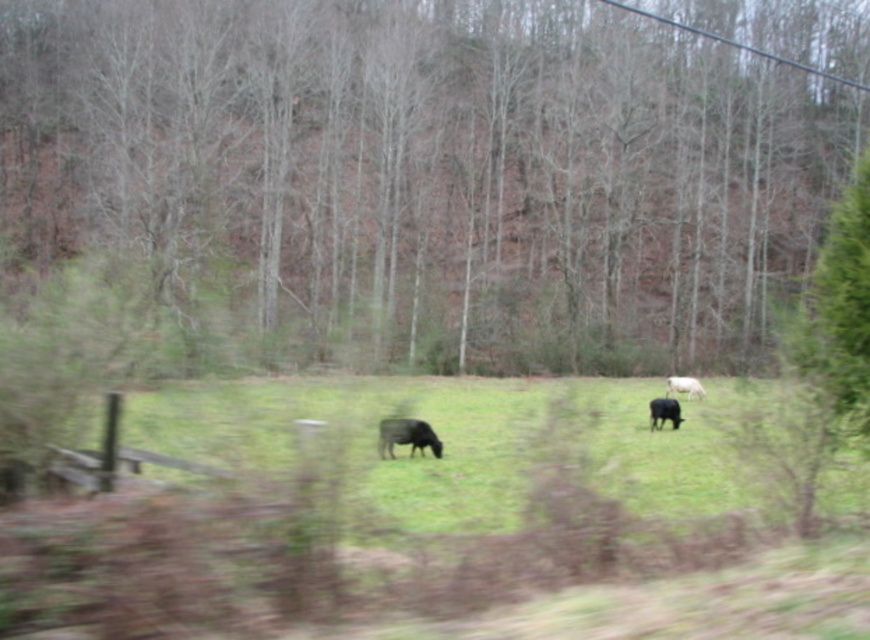
You are standing in the middle of the field and want to walk towards the brown bark tree at center. Which direction should you head?

You should head towards the center of the field since the brown bark tree at center is located at point coordinates (436,172), which is near the central area.